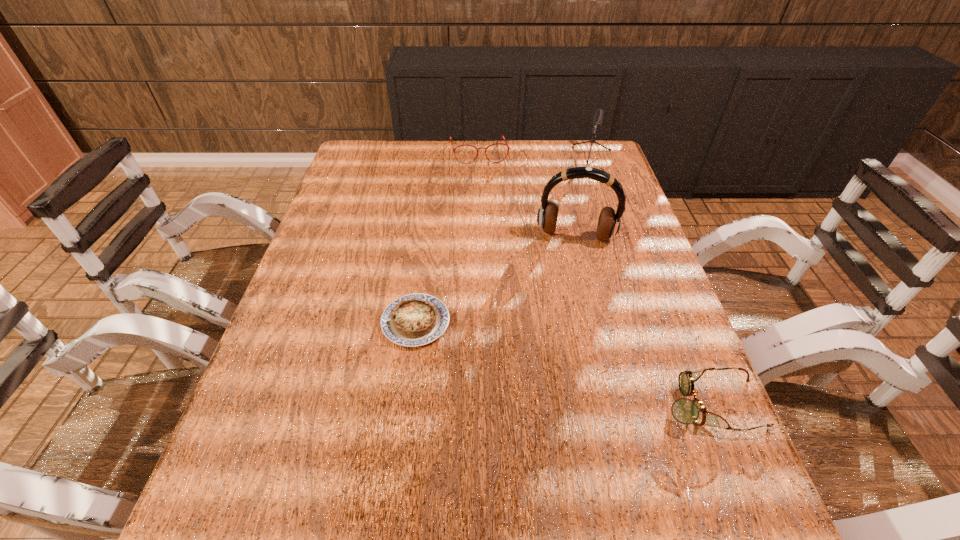
Identify the location of free space located on the ear cup of the tallest object. The width and height of the screenshot is (960, 540). click(560, 322).

This screenshot has height=540, width=960. I want to click on free space located 0.360m on the ear cup of the tallest object, so click(x=555, y=359).

The image size is (960, 540). Find the location of `vacant space located on the ear cup of the tallest object`. vacant space located on the ear cup of the tallest object is located at coordinates (562, 306).

This screenshot has width=960, height=540. Find the location of `free space located 0.250m on the stand of the microphone`. free space located 0.250m on the stand of the microphone is located at coordinates (569, 228).

The height and width of the screenshot is (540, 960). I want to click on vacant point located on the stand of the microphone, so click(x=564, y=244).

Locate an element on the screen. This screenshot has width=960, height=540. vacant space located 0.190m on the stand of the microphone is located at coordinates (573, 215).

The width and height of the screenshot is (960, 540). I want to click on free space located on the face of the left spectacles, so [x=484, y=176].

The width and height of the screenshot is (960, 540). What are the coordinates of `vacant space located on the face of the left spectacles` in the screenshot? It's located at (491, 210).

Find the location of `free point located 0.390m on the face of the left spectacles`. free point located 0.390m on the face of the left spectacles is located at coordinates (496, 240).

Where is `microphone that is positioned at the far edge`? microphone that is positioned at the far edge is located at coordinates (596, 121).